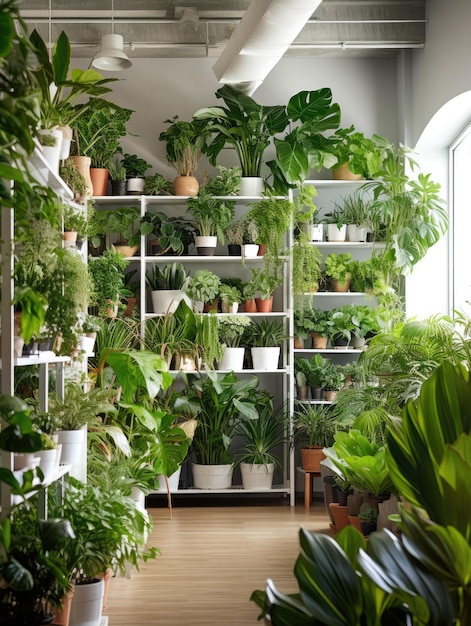
This screenshot has width=471, height=626. I want to click on small red clay pots, so click(x=266, y=305), click(x=251, y=304).